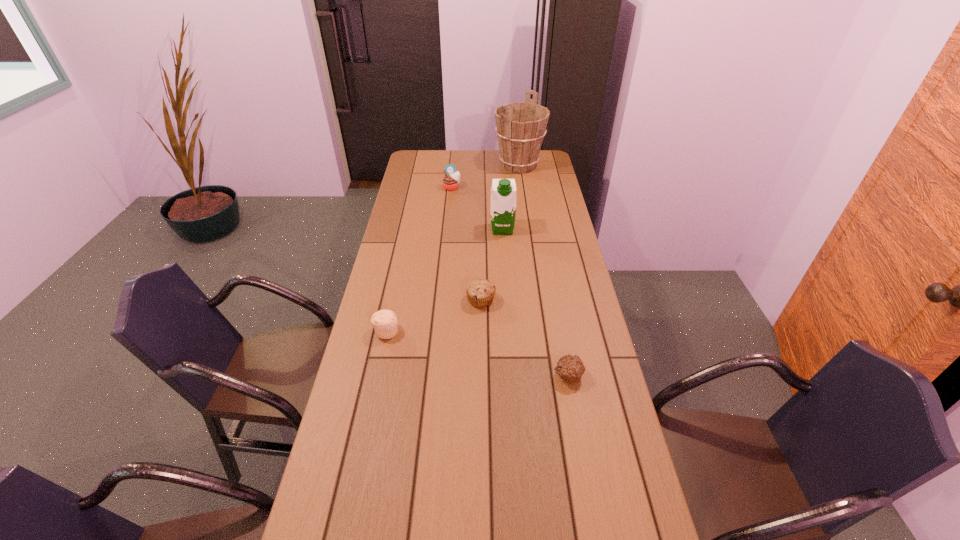
Find the location of a particular element. Image resolution: width=960 pixels, height=540 pixels. vacant space that satisfies the following two spatial constraints: 1. on the front-facing side of the rightmost muffin; 2. on the left side of the fourth nearest object is located at coordinates (513, 375).

Locate an element on the screen. Image resolution: width=960 pixels, height=540 pixels. blank space that satisfies the following two spatial constraints: 1. on the front-facing side of the second farthest muffin; 2. on the left side of the third muffin from right to left is located at coordinates (442, 300).

Locate an element on the screen. blank space that satisfies the following two spatial constraints: 1. on the front-facing side of the second object from left to right; 2. on the right side of the second farthest muffin is located at coordinates (442, 300).

Image resolution: width=960 pixels, height=540 pixels. Identify the location of free location that satisfies the following two spatial constraints: 1. on the front-facing side of the second object from left to right; 2. on the left side of the rightmost muffin. (x=434, y=375).

Image resolution: width=960 pixels, height=540 pixels. I want to click on free location that satisfies the following two spatial constraints: 1. on the front-facing side of the nearest muffin; 2. on the right side of the fourth nearest object, so 513,375.

You are a GUI agent. You are given a task and a screenshot of the screen. Output one action in this format:
    pyautogui.click(x=<x>, y=<y>)
    Task: Click on the free region that satisfies the following two spatial constraints: 1. on the front-facing side of the rightmost muffin; 2. on the left side of the fifth shortest object
    The width and height of the screenshot is (960, 540).
    Given the screenshot: What is the action you would take?
    pyautogui.click(x=513, y=375)

Find the location of a particular element. This screenshot has width=960, height=540. vacant space that satisfies the following two spatial constraints: 1. on the front-facing side of the shortest object; 2. on the left side of the soya milk is located at coordinates (513, 375).